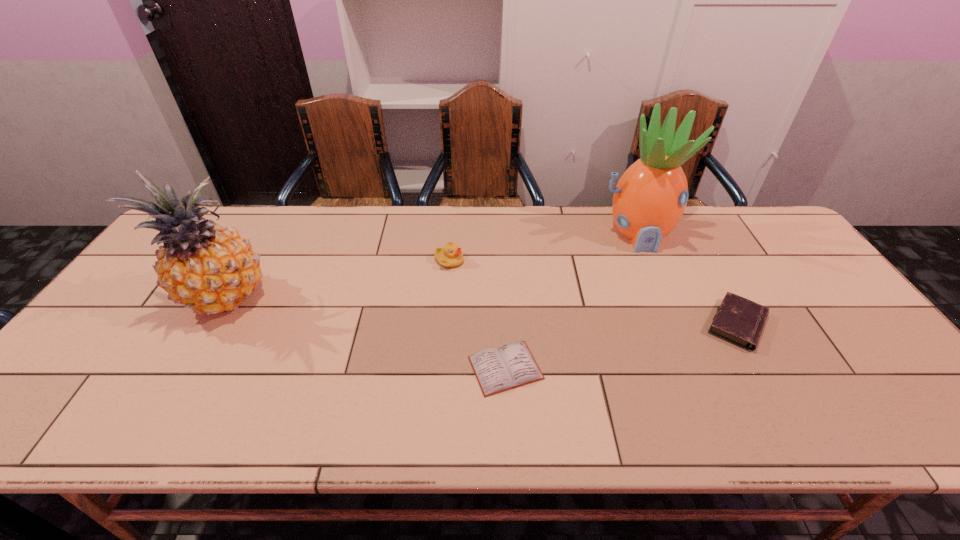
In order to click on blank area located on the back of the leftmost object in this screenshot , I will do `click(258, 244)`.

Find the location of `free space located 0.210m on the front-facing side of the second object from left to right`. free space located 0.210m on the front-facing side of the second object from left to right is located at coordinates (534, 261).

Image resolution: width=960 pixels, height=540 pixels. I want to click on vacant area situated on the left of the taller diary, so click(622, 325).

Locate an element on the screen. The height and width of the screenshot is (540, 960). free space located 0.270m on the left of the third object from right to left is located at coordinates (353, 368).

The image size is (960, 540). Find the location of `object at the far edge`. object at the far edge is located at coordinates (649, 199).

Locate an element on the screen. The height and width of the screenshot is (540, 960). object that is at the left edge is located at coordinates (209, 269).

Locate an element on the screen. Image resolution: width=960 pixels, height=540 pixels. vacant area at the far edge of the desktop is located at coordinates (740, 246).

You are a GUI agent. You are given a task and a screenshot of the screen. Output one action in this format:
    pyautogui.click(x=<x>, y=<y>)
    Task: Click on the vacant area at the near edge
    The image size is (960, 540).
    Given the screenshot: What is the action you would take?
    pyautogui.click(x=633, y=418)

I want to click on free spot at the left edge of the desktop, so click(113, 315).

Image resolution: width=960 pixels, height=540 pixels. In order to click on vacant space at the far right corner of the desktop in this screenshot , I will do `click(732, 222)`.